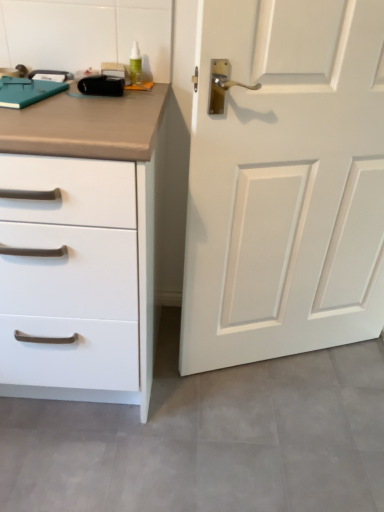
I want to click on vacant space underneath white matte door at right (from a real-world perspective), so click(x=291, y=356).